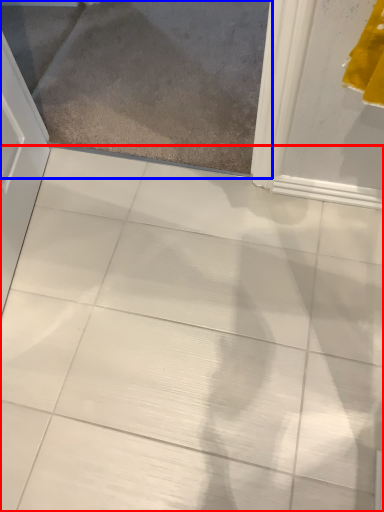
Question: Which object is further to the camera taking this photo, ceramic tile (highlighted by a red box) or glass door (highlighted by a blue box)?

Choices:
 (A) ceramic tile
 (B) glass door

Answer: (B)